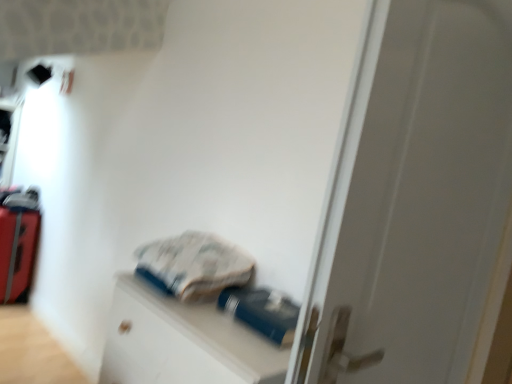
Question: Is blue matte file cabinet at center in front of or behind red suitcase at left in the image?

Choices:
 (A) front
 (B) behind

Answer: (A)

Question: Does point (123, 307) appear closer or farther from the camera than point (8, 241)?

Choices:
 (A) closer
 (B) farther

Answer: (A)

Question: Based on their relative distances, which object is farther from the blue matte file cabinet at center?

Choices:
 (A) white matte door at center
 (B) blue rubberized bottle at center
 (C) red suitcase at left

Answer: (C)

Question: Estimate the real-world distances between objects in this image. Which object is closer to the blue rubberized bottle at center?

Choices:
 (A) red suitcase at left
 (B) blue matte file cabinet at center
 (C) white matte door at center

Answer: (B)